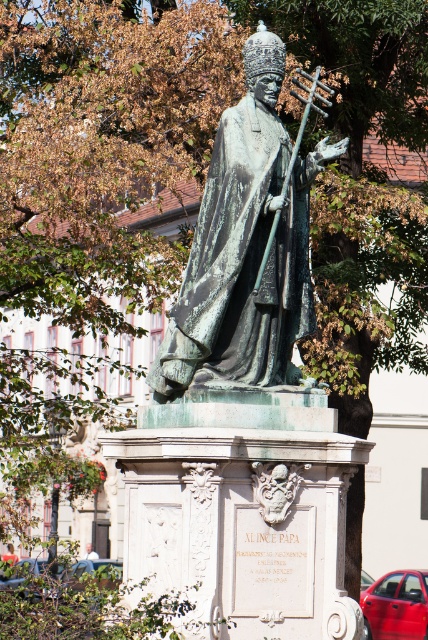
Question: Which point is closer to the camera?

Choices:
 (A) (279, 266)
 (B) (89, 550)

Answer: (A)

Question: Is green patina statue at center to the right of red fabric umbrella at lower left from the viewer's perspective?

Choices:
 (A) yes
 (B) no

Answer: (A)

Question: Among these objects, which one is nearest to the camera?

Choices:
 (A) green patina statue at center
 (B) red fabric umbrella at lower left

Answer: (A)

Question: Does green patina statue at center come behind red fabric umbrella at lower left?

Choices:
 (A) no
 (B) yes

Answer: (A)

Question: Considering the real-world distances, which object is closest to the red fabric umbrella at lower left?

Choices:
 (A) green patina statue at center
 (B) light brown wooden chair at center

Answer: (B)

Question: Is red fabric umbrella at lower left further to camera compared to light brown wooden chair at center?

Choices:
 (A) no
 (B) yes

Answer: (A)